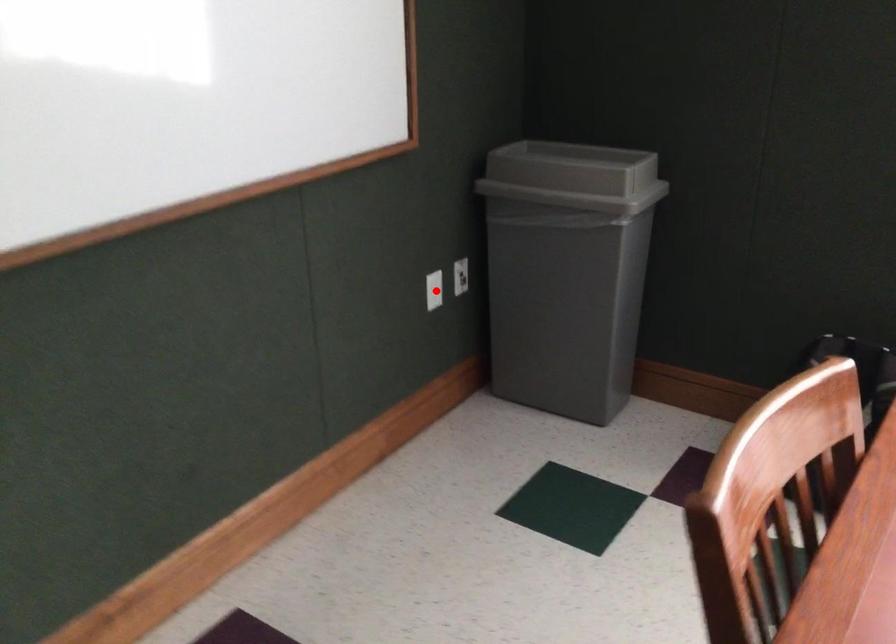
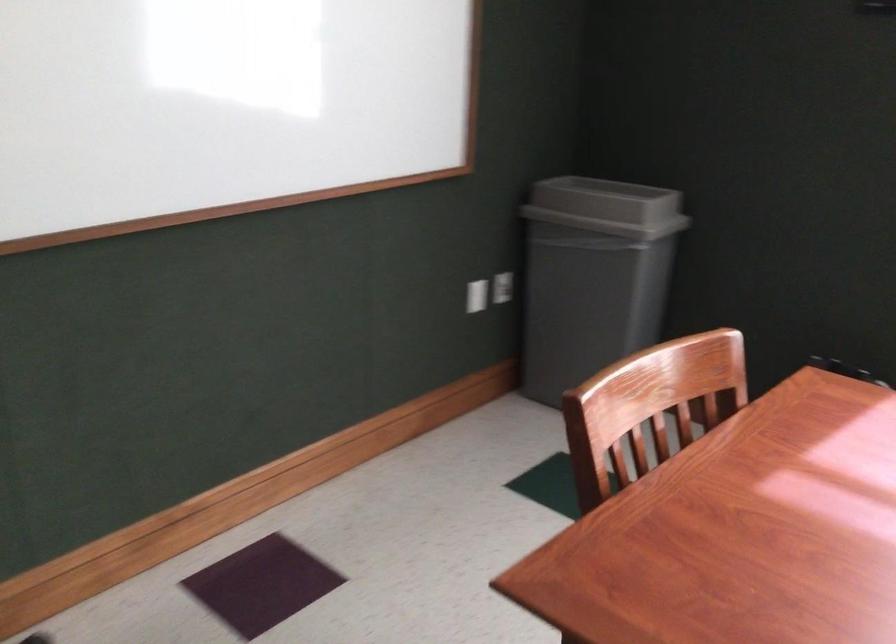
The point at the highlighted location is marked in the first image. Where is the corresponding point in the second image?

(477, 295)